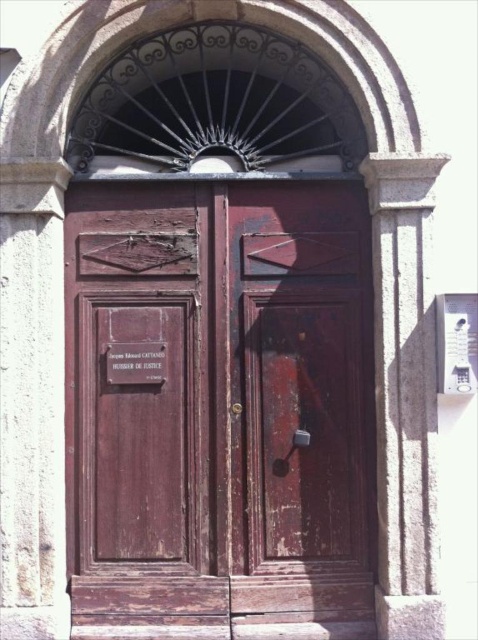
Question: Does rusty wood door at center have a larger size compared to metallic gray plaque at upper right?

Choices:
 (A) yes
 (B) no

Answer: (A)

Question: Can you confirm if metallic gray plaque at upper right is positioned to the right of matte wood sign at center?

Choices:
 (A) no
 (B) yes

Answer: (B)

Question: Which point is farther from the camera taking this photo?

Choices:
 (A) (234, 538)
 (B) (456, 324)
 (C) (122, 355)

Answer: (C)

Question: Which point is farther from the camera taking this photo?

Choices:
 (A) (90, 477)
 (B) (451, 312)
 (C) (128, 378)

Answer: (A)

Question: Is rusty wood door at center bigger than matte wood sign at center?

Choices:
 (A) yes
 (B) no

Answer: (A)

Question: Among these points, which one is farthest from the camera?

Choices:
 (A) (141, 378)
 (B) (247, 227)
 (C) (447, 314)

Answer: (B)